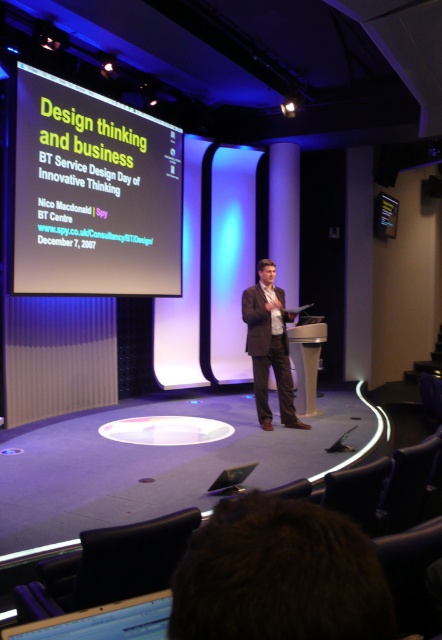
Question: Can you confirm if matte white projector screen at upper left is thinner than brown leather jacket at center?

Choices:
 (A) no
 (B) yes

Answer: (A)

Question: Which point is farther to the camera?

Choices:
 (A) (273, 298)
 (B) (119, 234)

Answer: (B)

Question: Does matte white projector screen at upper left appear under brown leather jacket at center?

Choices:
 (A) yes
 (B) no

Answer: (B)

Question: Can you confirm if matte white projector screen at upper left is positioned to the right of brown leather jacket at center?

Choices:
 (A) no
 (B) yes

Answer: (A)

Question: Which object appears closest to the camera in this image?

Choices:
 (A) brown leather jacket at center
 (B) matte white projector screen at upper left

Answer: (B)